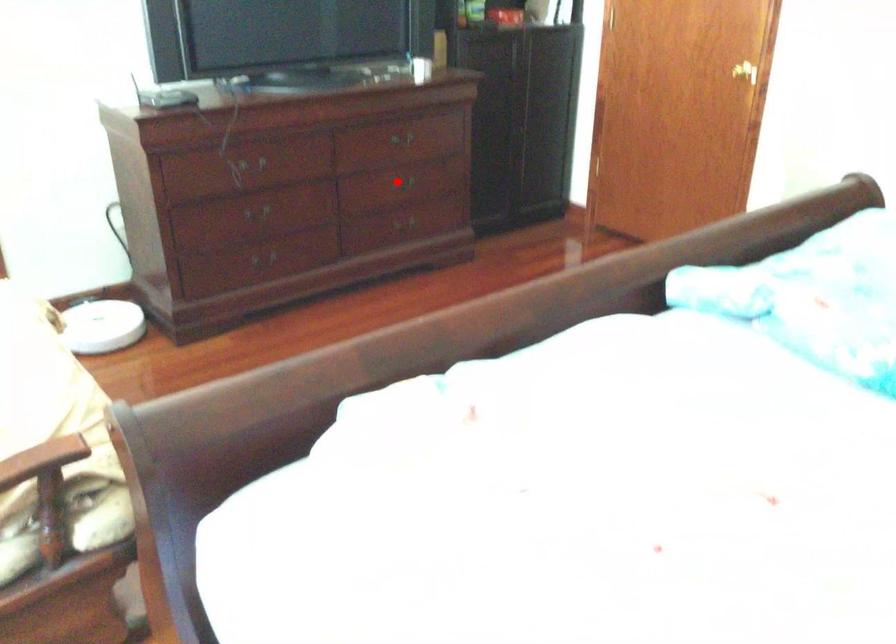
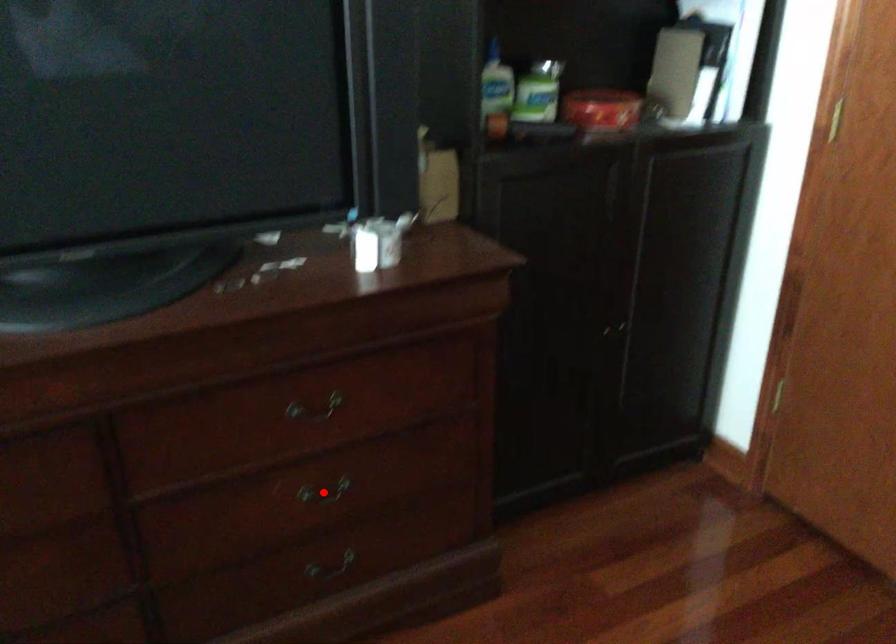
I am providing you with two images of the same scene from different viewpoints. A red point is marked on the first image and another point is marked on the second image. Do the highlighted points in image1 and image2 indicate the same real-world spot?

Yes